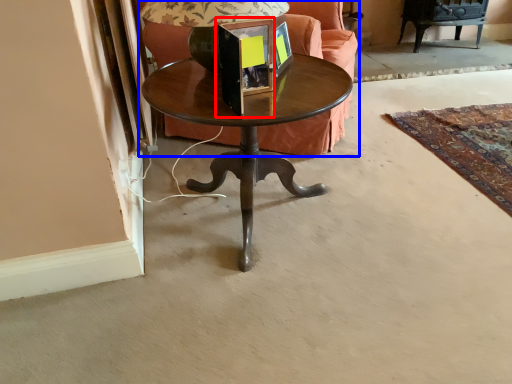
Question: Which object appears farthest to the camera in this image, picture frame (highlighted by a red box) or studio couch (highlighted by a blue box)?

Choices:
 (A) picture frame
 (B) studio couch

Answer: (B)